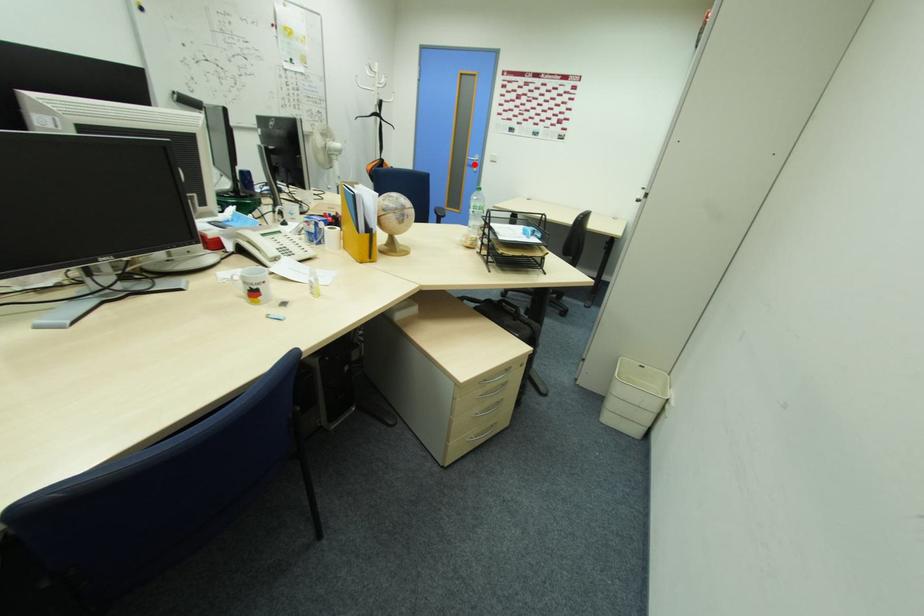
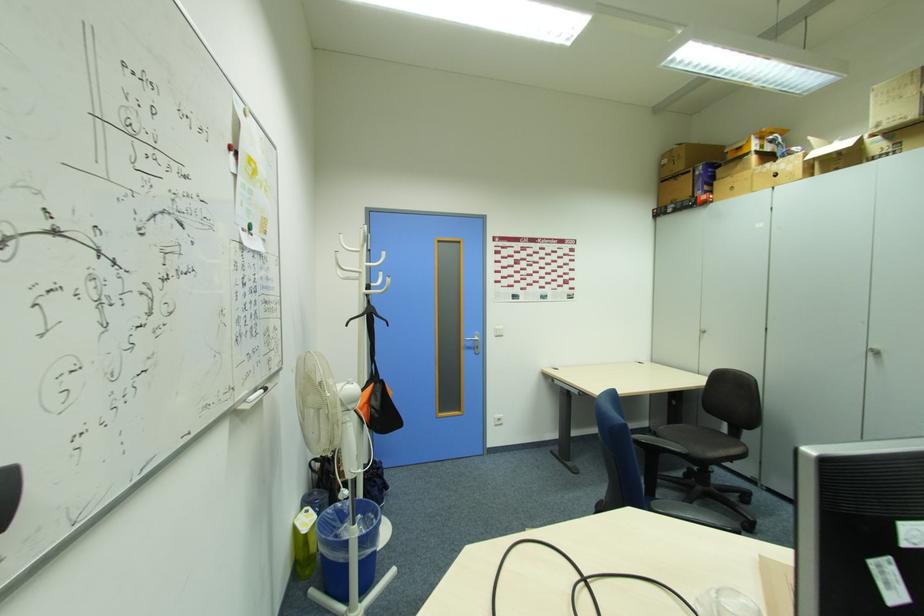
Where in the second image is the point corresponding to the highlighted location from the first image?

(472, 346)